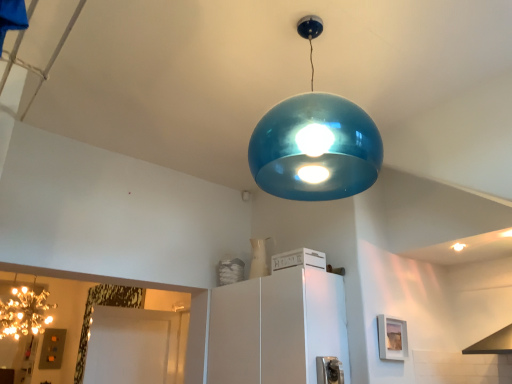
Question: Looking at their shapes, would you say white matte crate at center, marked as the 1th appliance in a top-to-bottom arrangement, is wider or thinner than white matte cabinet at center?

Choices:
 (A) wide
 (B) thin

Answer: (B)

Question: Choose the correct answer: Is white matte crate at center, arranged as the 1th appliance when viewed from the back, inside white matte cabinet at center or outside it?

Choices:
 (A) inside
 (B) outside

Answer: (B)

Question: Estimate the real-world distances between objects in this image. Which object is closer to the sparkling gold chandelier at left?

Choices:
 (A) glossy metallic light bulb at upper center
 (B) white matte cabinet at center
 (C) metallic silver outlet at lower center, which is the 1th appliance in bottom-to-top order
 (D) white matte crate at center, acting as the 2th appliance starting from the front

Answer: (B)

Question: Which object is the closest to the white matte crate at center, marked as the 1th appliance in a top-to-bottom arrangement?

Choices:
 (A) sparkling gold chandelier at left
 (B) white matte cabinet at center
 (C) metallic silver outlet at lower center, which ranks as the 2th appliance in back-to-front order
 (D) glossy metallic light bulb at upper center

Answer: (B)